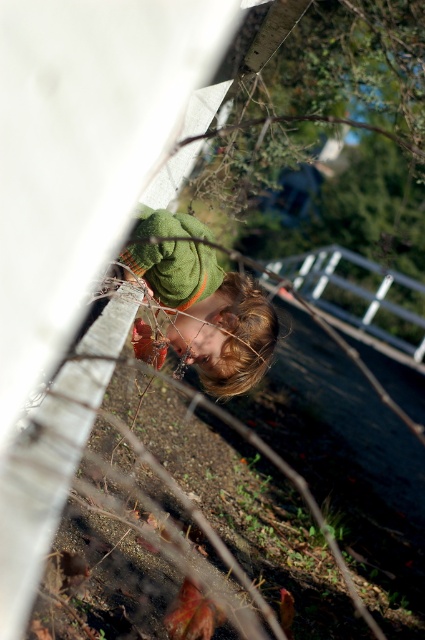
You are a photographer trying to capture a clear shot of the child in the image. The child is wearing a green knitted sweater at upper center and is partially hidden by the metallic silver fence at center. To get a better view of the child, should you move to the left or the right of your current position?

Since the green knitted sweater at upper center is to the left of the metallic silver fence at center, moving to the right of your current position would help you see around the fence and get a clearer view of the child.

You are a photographer trying to capture a clear shot of the child in the scene. The green knitted sweater at upper center and the metallic silver fence at center are blocking your view. Which object should you move closer to the camera to reduce the obstruction?

The green knitted sweater at upper center has a lesser width compared to the metallic silver fence at center, so moving it closer to the camera would reduce the obstruction more effectively since it is narrower and takes up less space in the frame.

You are standing in front of a fence with branches blocking part of your view. There is a point at coordinates point (206, 374) that you want to reach. If your arm can reach up to 8 feet, can you touch that point without moving your feet?

The distance of point (206, 374) from viewer is 9.07 feet, so no, you cannot touch it because it is farther than your arm can reach.